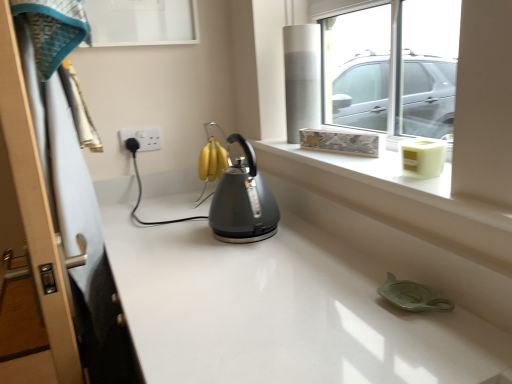
Describe the element at coordinates (397, 199) in the screenshot. This screenshot has width=512, height=384. I see `white textured ledge at upper right` at that location.

You are a GUI agent. You are given a task and a screenshot of the screen. Output one action in this format:
    pyautogui.click(x=<x>, y=<y>)
    Task: Click on the white plastic socket at upper left
    Image resolution: width=512 pixels, height=384 pixels.
    Given the screenshot: What is the action you would take?
    pyautogui.click(x=142, y=137)

Image resolution: width=512 pixels, height=384 pixels. What are the coordinates of `satin grey kettle at center` in the screenshot? It's located at (243, 202).

Locate an element on the screen. screen door below the satin grey kettle at center (from the image's perspective) is located at coordinates (35, 204).

Which object is more forward, satin grey kettle at center or wooden screen door at left?

Positioned in front is wooden screen door at left.

From the image's perspective, which one is positioned lower, satin grey kettle at center or wooden screen door at left?

wooden screen door at left appears lower in the image.

Consider the image. Can you tell me how much satin grey kettle at center and wooden screen door at left differ in facing direction?

2.02 degrees separate the facing orientations of satin grey kettle at center and wooden screen door at left.

Does white plastic socket at upper left contain wooden screen door at left?

Actually, wooden screen door at left is outside white plastic socket at upper left.

Does white plastic socket at upper left have a lesser height compared to wooden screen door at left?

Correct, white plastic socket at upper left is not as tall as wooden screen door at left.

Which object is positioned more to the left, white plastic socket at upper left or wooden screen door at left?

Positioned to the left is wooden screen door at left.

From the image's perspective, between white plastic socket at upper left and wooden screen door at left, which one is located above?

white plastic socket at upper left is shown above in the image.

This screenshot has height=384, width=512. I want to click on kettle below the white plastic socket at upper left (from the image's perspective), so click(243, 202).

From the image's perspective, is satin grey kettle at center on white plastic socket at upper left?

Actually, satin grey kettle at center appears below white plastic socket at upper left in the image.

Which point is more forward, [258,175] or [143,133]?

Positioned in front is point [258,175].

Does satin grey kettle at center appear on the left side of white plastic socket at upper left?

No, satin grey kettle at center is not to the left of white plastic socket at upper left.

Considering the positions of objects white plastic socket at upper left and white textured ledge at upper right in the image provided, who is more to the left, white plastic socket at upper left or white textured ledge at upper right?

From the viewer's perspective, white plastic socket at upper left appears more on the left side.

Which is in front, white plastic socket at upper left or white textured ledge at upper right?

white textured ledge at upper right is in front.

How distant is white plastic socket at upper left from white textured ledge at upper right?

white plastic socket at upper left is 31.65 inches from white textured ledge at upper right.

Which is in front, point (149, 135) or point (433, 180)?

Positioned in front is point (433, 180).

How many degrees apart are the facing directions of satin grey kettle at center and transparent glass window at upper center?

They differ by 0.526 degrees in their facing directions.

Is transparent glass window at upper center located within satin grey kettle at center?

No.

Find the location of a particular element. This screenshot has height=384, width=512. window located above the satin grey kettle at center (from a real-world perspective) is located at coordinates (393, 67).

Which object is thinner, satin grey kettle at center or transparent glass window at upper center?

transparent glass window at upper center.

Does point (213, 233) lie in front of point (332, 185)?

That is False.

From the image's perspective, is satin grey kettle at center located above white textured ledge at upper right?

Actually, satin grey kettle at center appears below white textured ledge at upper right in the image.

Measure the distance from satin grey kettle at center to white textured ledge at upper right.

satin grey kettle at center and white textured ledge at upper right are 11.31 inches apart from each other.

Consider the image. Between white plastic socket at upper left and transparent glass window at upper center, which one has smaller size?

white plastic socket at upper left.

In terms of width, does white plastic socket at upper left look wider or thinner when compared to transparent glass window at upper center?

white plastic socket at upper left is thinner than transparent glass window at upper center.

Looking at this image, can you confirm if white plastic socket at upper left is positioned to the right of transparent glass window at upper center?

Incorrect, white plastic socket at upper left is not on the right side of transparent glass window at upper center.

At what (x,y) coordinates should I click in order to perform the action: click on screen door that appears on the left of satin grey kettle at center. Please return your answer as a coordinate pair (x, y). The height and width of the screenshot is (384, 512). Looking at the image, I should click on pyautogui.click(x=35, y=204).

This screenshot has height=384, width=512. In the image, there is a white plastic socket at upper left. What are the coordinates of `screen door below it (from the image's perspective)` in the screenshot? It's located at (35, 204).

When comparing their distances from white textured ledge at upper right, does wooden screen door at left or satin grey kettle at center seem further?

wooden screen door at left is positioned further to the anchor white textured ledge at upper right.

Looking at the image, which one is located closer to white textured ledge at upper right, satin grey kettle at center or white plastic socket at upper left?

satin grey kettle at center lies closer to white textured ledge at upper right than the other object.

Estimate the real-world distances between objects in this image. Which object is further from satin grey kettle at center, white plastic socket at upper left or transparent glass window at upper center?

transparent glass window at upper center.

Based on the photo, which object lies nearer to the anchor point transparent glass window at upper center, satin grey kettle at center or wooden screen door at left?

satin grey kettle at center is positioned closer to the anchor transparent glass window at upper center.

Looking at the image, which one is located further to wooden screen door at left, white plastic socket at upper left or white textured ledge at upper right?

Among the two, white plastic socket at upper left is located further to wooden screen door at left.

From the image, which object appears to be nearer to white textured ledge at upper right, transparent glass window at upper center or satin grey kettle at center?

satin grey kettle at center is closer to white textured ledge at upper right.

Estimate the real-world distances between objects in this image. Which object is closer to wooden screen door at left, white textured ledge at upper right or white plastic socket at upper left?

white textured ledge at upper right is positioned closer to the anchor wooden screen door at left.

Considering their positions, is wooden screen door at left positioned further to satin grey kettle at center than white plastic socket at upper left?

Among the two, white plastic socket at upper left is located further to satin grey kettle at center.

Find the location of a particular element. The image size is (512, 384). kettle between wooden screen door at left and transparent glass window at upper center in the horizontal direction is located at coordinates click(x=243, y=202).

Locate an element on the screen. The width and height of the screenshot is (512, 384). ledge positioned between wooden screen door at left and white plastic socket at upper left from near to far is located at coordinates (397, 199).

Locate an element on the screen. The width and height of the screenshot is (512, 384). kettle between wooden screen door at left and white plastic socket at upper left in the front-back direction is located at coordinates (243, 202).

Find the location of a particular element. ledge located between satin grey kettle at center and transparent glass window at upper center in the left-right direction is located at coordinates (x=397, y=199).